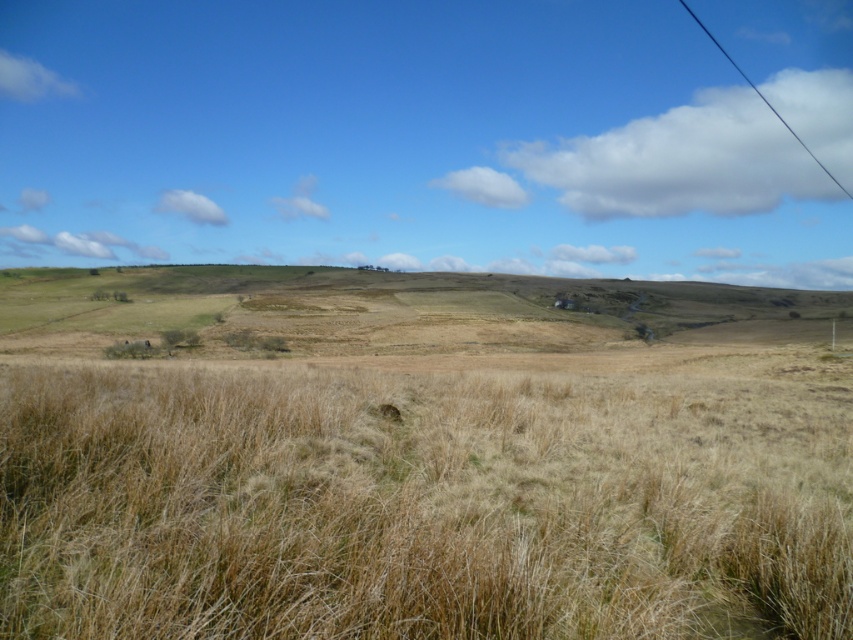
Can you confirm if dry grass at center is taller than dry grassland at center?

Incorrect, dry grass at center's height is not larger of dry grassland at center's.

Based on the photo, is dry grass at center wider than dry grassland at center?

No, dry grass at center is not wider than dry grassland at center.

Find the location of a particular element. dry grass at center is located at coordinates tap(419, 506).

Identify the location of dry grass at center. Image resolution: width=853 pixels, height=640 pixels. (419, 506).

Is point (410, 579) behind point (747, 80)?

No, it is in front of (747, 80).

Is dry grass at center below black wire at upper right?

Correct, dry grass at center is located below black wire at upper right.

Image resolution: width=853 pixels, height=640 pixels. Identify the location of dry grass at center. (419, 506).

Is dry grassland at center taller than black wire at upper right?

In fact, dry grassland at center may be shorter than black wire at upper right.

How distant is dry grassland at center from black wire at upper right?

dry grassland at center and black wire at upper right are 245.14 meters apart from each other.

Between point (170, 275) and point (682, 1), which one is positioned in front?

Point (170, 275)

Find the location of a particular element. dry grassland at center is located at coordinates (370, 308).